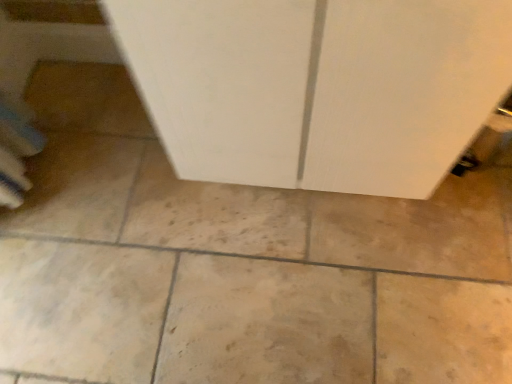
Find the location of a particular element. The height and width of the screenshot is (384, 512). white matte cabinet at center is located at coordinates (317, 87).

This screenshot has height=384, width=512. Describe the element at coordinates (317, 87) in the screenshot. I see `white matte cabinet at center` at that location.

What is the approximate width of white matte cabinet at center?

It is 18.27 inches.

Where is `white matte cabinet at center`? This screenshot has width=512, height=384. white matte cabinet at center is located at coordinates tap(317, 87).